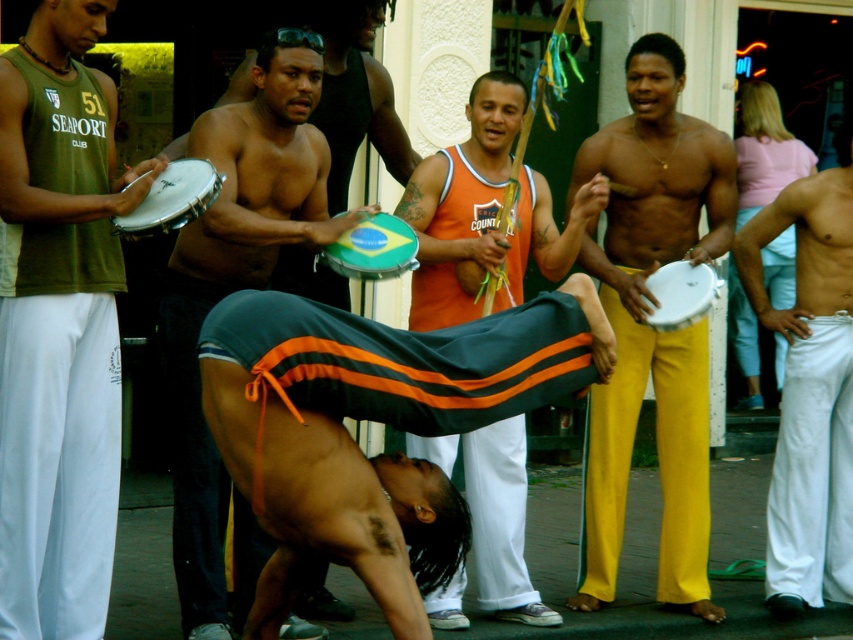
Is yellow cotton pants at center to the right of white cotton pants at right from the viewer's perspective?

In fact, yellow cotton pants at center is to the left of white cotton pants at right.

Who is lower down, yellow cotton pants at center or white cotton pants at right?

white cotton pants at right is below.

Locate an element on the screen. This screenshot has width=853, height=640. yellow cotton pants at center is located at coordinates (648, 328).

Is matte green tank top at left shorter than white cotton pants at right?

Incorrect, matte green tank top at left's height does not fall short of white cotton pants at right's.

Who is more distant from viewer, (107, 269) or (827, 358)?

The point (827, 358) is behind.

Describe the element at coordinates (59, 323) in the screenshot. I see `matte green tank top at left` at that location.

This screenshot has height=640, width=853. What are the coordinates of `matte green tank top at left` in the screenshot? It's located at (59, 323).

Is matte green tank top at left smaller than yellow cotton pants at center?

Indeed, matte green tank top at left has a smaller size compared to yellow cotton pants at center.

Is point (56, 182) in front of point (653, 193)?

That is True.

This screenshot has height=640, width=853. I want to click on matte green tank top at left, so click(x=59, y=323).